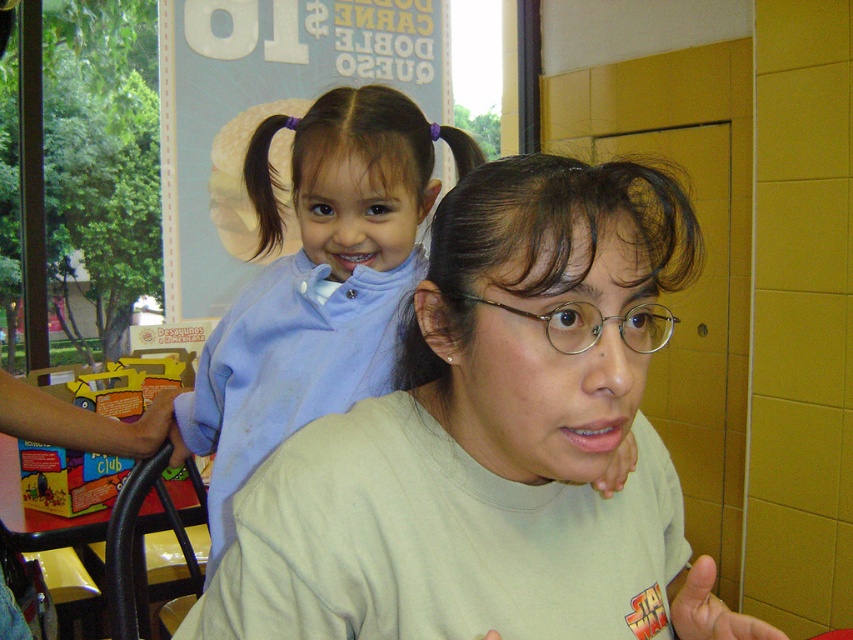
You are a customer in a fast food restaurant and you see the dark brown silky hair at center and the yellow plastic toy car at upper left. Which object is higher in the image?

The dark brown silky hair at center is taller than the yellow plastic toy car at upper left.